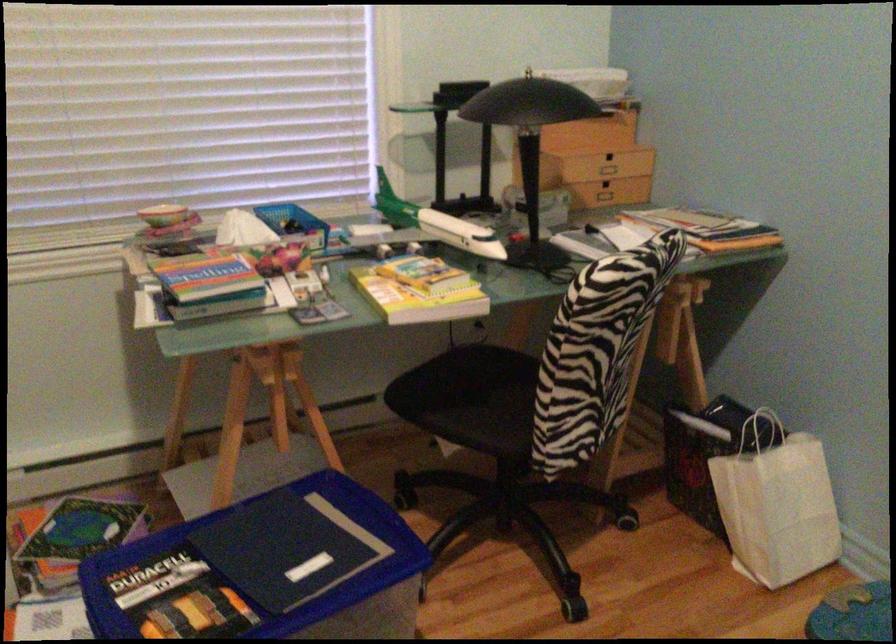
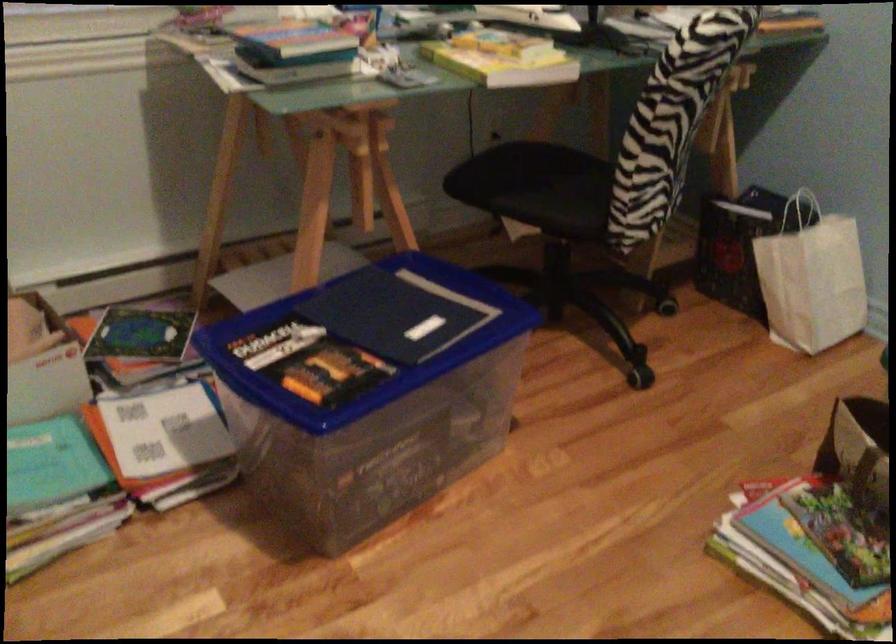
Question: The first image is from the beginning of the video and the second image is from the end. How did the camera likely rotate when shooting the video?

Choices:
 (A) Left
 (B) Right
 (C) Up
 (D) Down

Answer: (D)